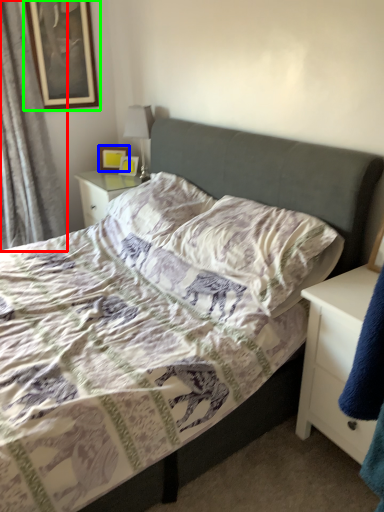
Question: Which is farther away from curtain (highlighted by a red box)? picture frame (highlighted by a blue box) or picture frame (highlighted by a green box)?

Choices:
 (A) picture frame
 (B) picture frame

Answer: (A)